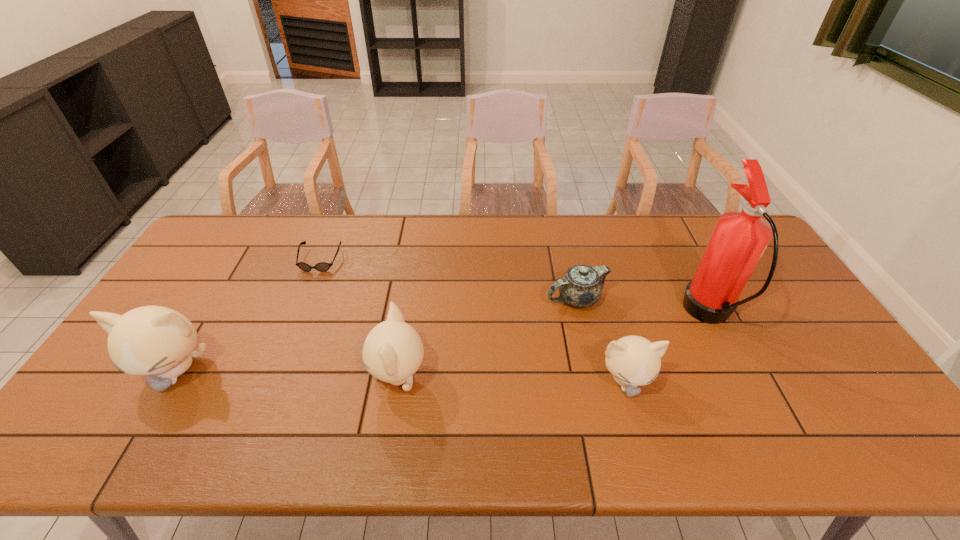
At what (x,y) coordinates should I click in order to perform the action: click on free point between the leftmost object and the second object from left to right. Please return your answer as a coordinate pair (x, y). The height and width of the screenshot is (540, 960). Looking at the image, I should click on (248, 315).

At what (x,y) coordinates should I click in order to perform the action: click on vacant area that lies between the rightmost object and the farthest object. Please return your answer as a coordinate pair (x, y). The image size is (960, 540). Looking at the image, I should click on (515, 287).

The height and width of the screenshot is (540, 960). I want to click on vacant point located between the leftmost kitten and the fire extinguisher, so click(x=443, y=342).

You are a GUI agent. You are given a task and a screenshot of the screen. Output one action in this format:
    pyautogui.click(x=<x>, y=<y>)
    Task: Click on the unoccupied area between the second shortest object and the sunglasses
    This screenshot has width=960, height=540.
    Given the screenshot: What is the action you would take?
    pyautogui.click(x=448, y=280)

Find the location of a particular element. free spot between the rightmost object and the leftmost object is located at coordinates (443, 342).

In order to click on vacant space that's between the shortest kitten and the chinaware in this screenshot , I will do `click(601, 340)`.

Find the location of a particular element. object that stands as the closest to the shortest kitten is located at coordinates (740, 238).

Locate which object ranks fourth in proximity to the chinaware. Please provide its 2D coordinates. Your answer should be formatted as a tuple, i.e. [(x, y)], where the tuple contains the x and y coordinates of a point satisfying the conditions above.

[(321, 266)]

Locate an element on the screen. the second closest kitten relative to the sunglasses is located at coordinates (393, 351).

Image resolution: width=960 pixels, height=540 pixels. I want to click on the second closest kitten to the shortest kitten, so click(x=151, y=340).